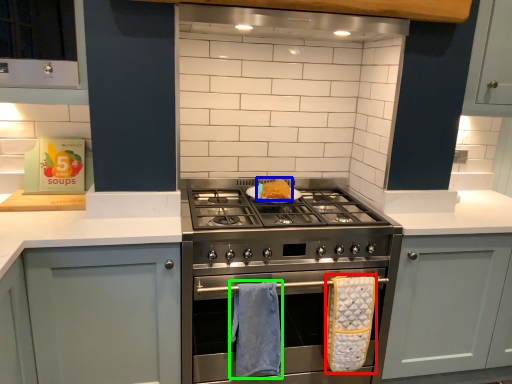
Question: Which is nearer to the bath towel (highlighted by a red box)? food (highlighted by a blue box) or bath towel (highlighted by a green box).

Choices:
 (A) food
 (B) bath towel

Answer: (B)